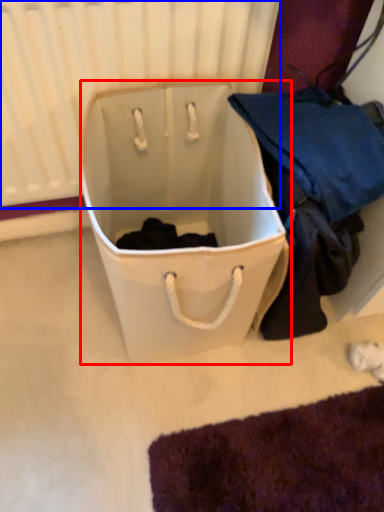
Question: Which point is closer to the camera, luggage and bags (highlighted by a red box) or radiator (highlighted by a blue box)?

Choices:
 (A) luggage and bags
 (B) radiator

Answer: (A)